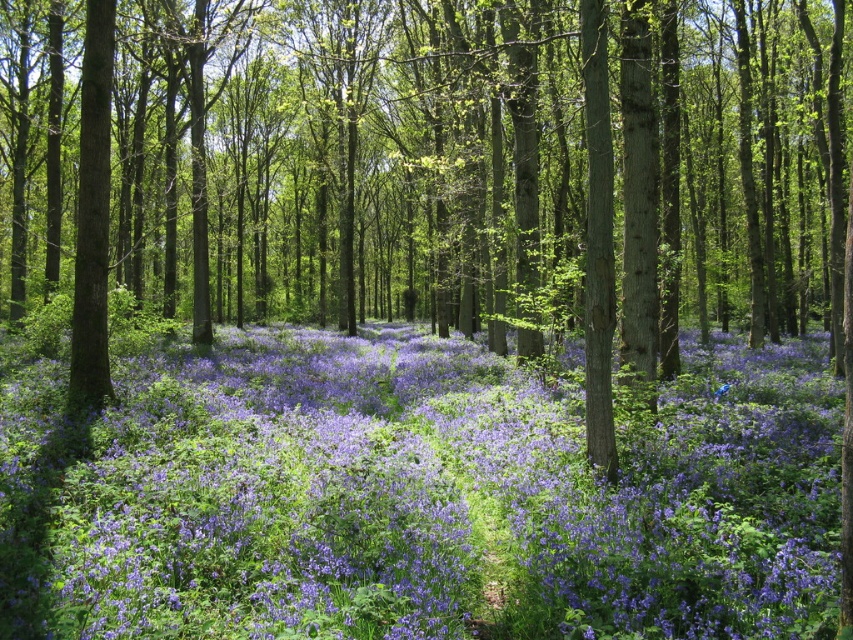
You are a photographer aiming to capture the purple matte flowers at center and the green rough bark tree at center in a single shot. Which object should you position closer to the left side of your camera frame to ensure both are visible?

To ensure both the green rough bark tree at center and the purple matte flowers at center are visible in your shot, you should position the green rough bark tree at center closer to the left side of your camera frame since it is already positioned on the left side of the purple matte flowers at center.

You are standing at the origin point in the forest scene. You want to walk to the green rough bark tree at center. Which direction should you move in to reach it?

The green rough bark tree at center is located at coordinates point (x=436, y=168), so you should move in the direction of the coordinates (x=436, y=168) to reach it.

You are planning to place a small wooden bench between the green rough bark tree at center and the purple matte flowers at center. Based on their widths, will the bench fit snugly without overlapping either object?

The green rough bark tree at center might be wider than purple matte flowers at center, so the bench might not fit snugly as the tree could take up more space than the flowers. Check the exact widths before placing the bench.